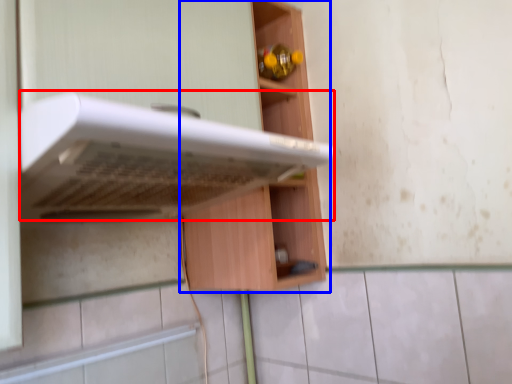
Question: Which object is further to the camera taking this photo, oven (highlighted by a red box) or cabinetry (highlighted by a blue box)?

Choices:
 (A) oven
 (B) cabinetry

Answer: (B)